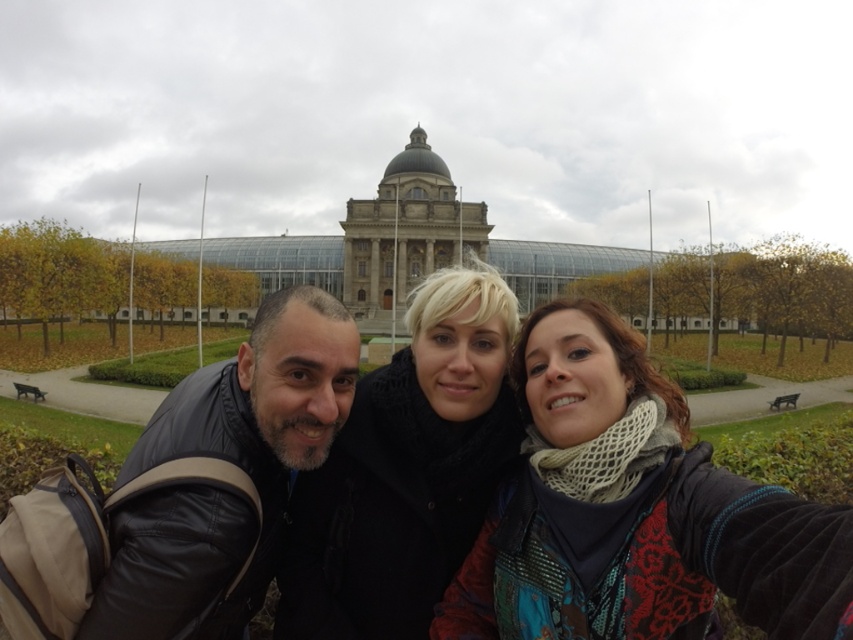
Question: Which point appears farthest from the camera in this image?

Choices:
 (A) [x=207, y=586]
 (B) [x=625, y=545]

Answer: (B)

Question: Estimate the real-world distances between objects in this image. Which object is farther from the knitted scarf at center?

Choices:
 (A) black woolen scarf at center
 (B) black leather jacket at lower left

Answer: (B)

Question: Which object is positioned farthest from the knitted scarf at center?

Choices:
 (A) black leather jacket at lower left
 (B) black woolen scarf at center

Answer: (A)

Question: Can you confirm if knitted scarf at center is wider than black woolen scarf at center?

Choices:
 (A) no
 (B) yes

Answer: (B)

Question: Is black woolen scarf at center to the right of black leather jacket at lower left from the viewer's perspective?

Choices:
 (A) no
 (B) yes

Answer: (B)

Question: Where is knitted scarf at center located in relation to black woolen scarf at center in the image?

Choices:
 (A) below
 (B) above

Answer: (A)